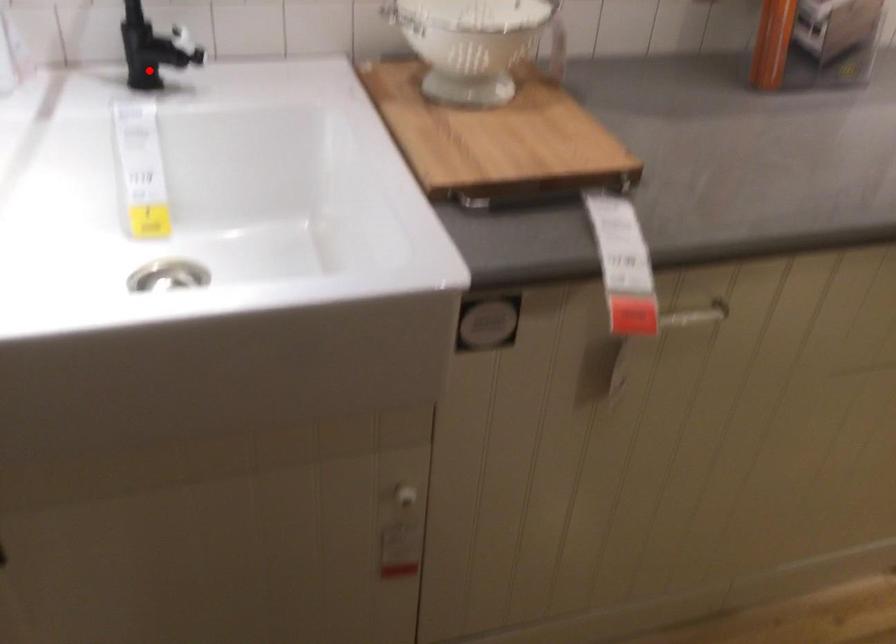
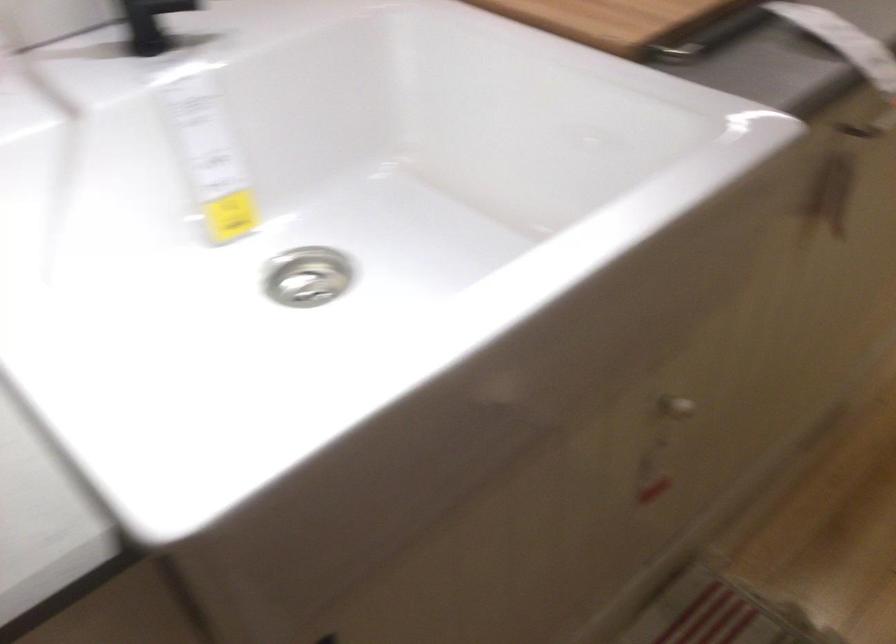
Question: I am providing you with two images of the same scene from different viewpoints. Given a red point in image1, look at the same physical point in image2. Is it:

Choices:
 (A) Closer to the viewpoint
 (B) Farther from the viewpoint

Answer: (A)